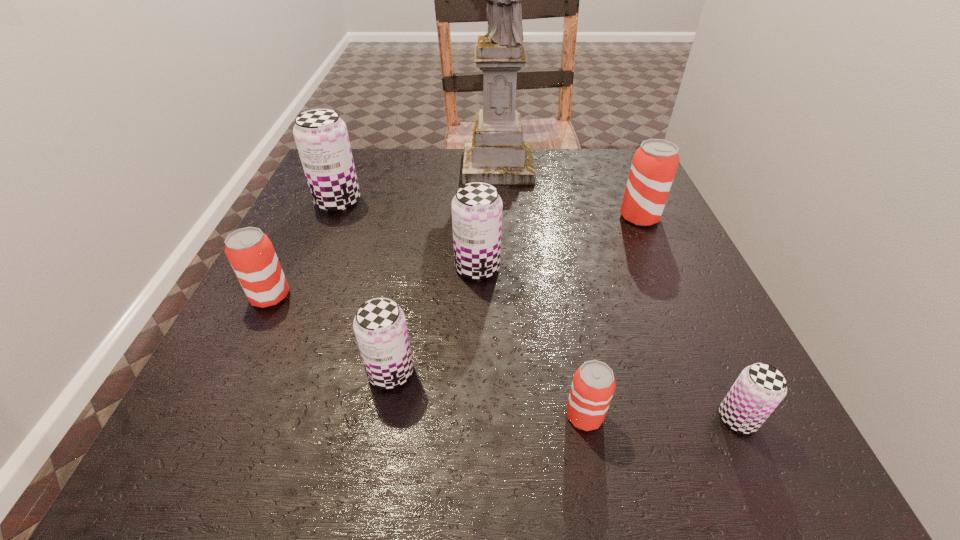
Locate an element on the screen. Image resolution: width=960 pixels, height=540 pixels. vacant area situated 0.320m on the left of the biggest orange beer can is located at coordinates (472, 217).

Locate an element on the screen. This screenshot has height=540, width=960. vacant area situated on the left of the third smallest purple beer can is located at coordinates (360, 267).

The image size is (960, 540). What are the coordinates of `vacant area located 0.080m on the back of the leftmost orange beer can` in the screenshot? It's located at (290, 255).

I want to click on vacant space located on the right of the second smallest purple beer can, so click(473, 372).

Find the location of a particular element. vacant space located 0.300m on the left of the rightmost purple beer can is located at coordinates (502, 418).

Locate an element on the screen. This screenshot has width=960, height=540. vacant space located 0.290m on the left of the second orange beer can from right to left is located at coordinates (358, 416).

This screenshot has height=540, width=960. In order to click on sculpture that is at the far edge in this screenshot , I will do `click(497, 154)`.

This screenshot has height=540, width=960. What are the coordinates of `beer can positioned at the far edge` in the screenshot? It's located at (321, 136).

At what (x,y) coordinates should I click in order to perform the action: click on object at the far left corner. Please return your answer as a coordinate pair (x, y). This screenshot has width=960, height=540. Looking at the image, I should click on (321, 136).

Find the location of `object that is at the near right corner`. object that is at the near right corner is located at coordinates pyautogui.click(x=759, y=389).